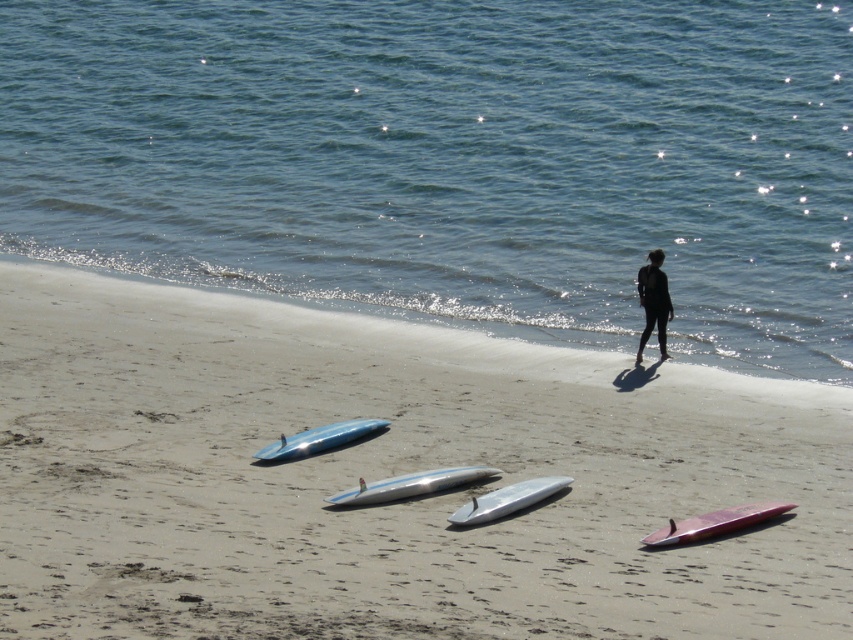
Question: Which object appears closest to the camera in this image?

Choices:
 (A) smooth sand at lower center
 (B) shiny silver surfboard at center
 (C) shiny pink surfboard at lower right

Answer: (A)

Question: From the image, what is the correct spatial relationship of shiny pink surfboard at lower right in relation to black matte wetsuit at center?

Choices:
 (A) left
 (B) right

Answer: (B)

Question: Which object is farther from the camera taking this photo?

Choices:
 (A) black matte wetsuit at center
 (B) glossy blue surfboard at lower left

Answer: (A)

Question: Is shiny silver surfboard at center bigger than black matte wetsuit at center?

Choices:
 (A) no
 (B) yes

Answer: (A)

Question: Is shiny silver surfboard at center positioned behind glossy blue surfboard at lower left?

Choices:
 (A) no
 (B) yes

Answer: (A)

Question: Which of the following is the closest to the observer?

Choices:
 (A) (283, 552)
 (B) (419, 481)
 (C) (692, 536)

Answer: (A)